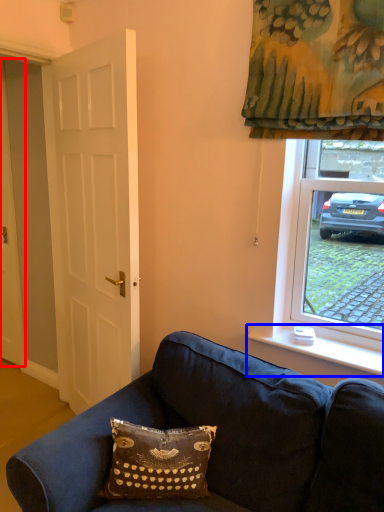
Question: Which point is closer to the camera, door (highlighted by a red box) or window sill (highlighted by a blue box)?

Choices:
 (A) door
 (B) window sill

Answer: (B)